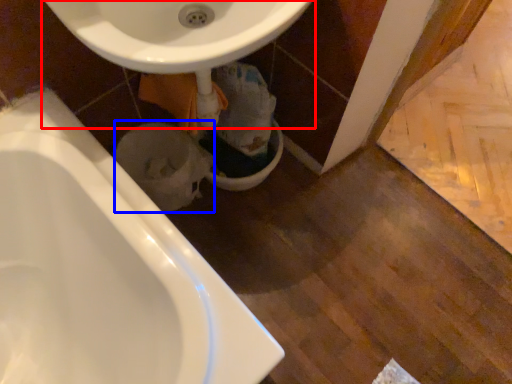
Question: Which object appears closest to the camera in this image, sink (highlighted by a red box) or toilet bowl (highlighted by a blue box)?

Choices:
 (A) sink
 (B) toilet bowl

Answer: (A)